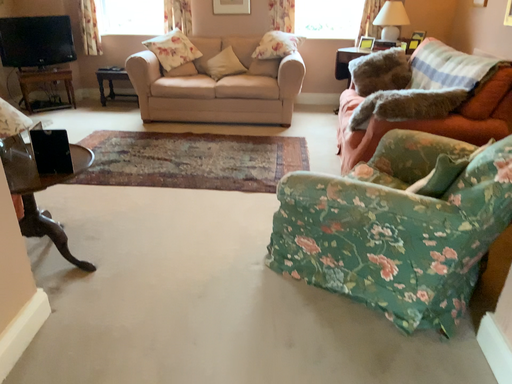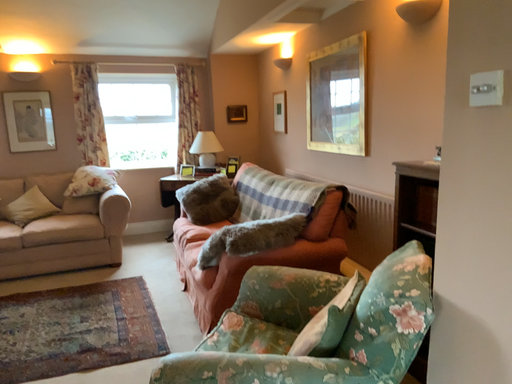
Question: How did the camera likely rotate when shooting the video?

Choices:
 (A) rotated downward
 (B) rotated upward

Answer: (B)